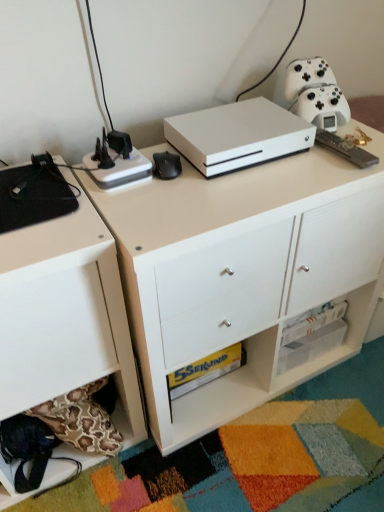
Locate an element on the screen. The height and width of the screenshot is (512, 384). free point above white matte gaming console at center, which is the 2th appliance in right-to-left order (from a real-world perspective) is located at coordinates (232, 118).